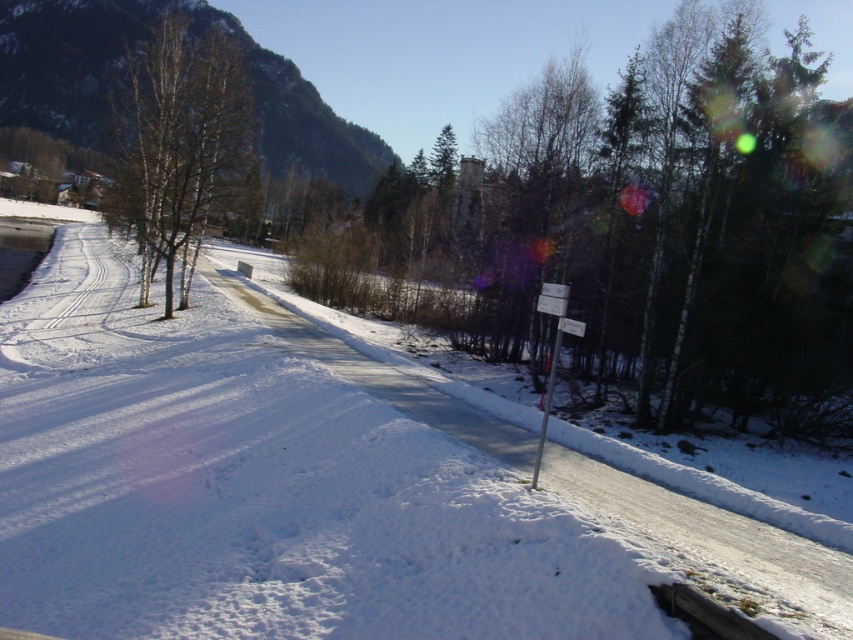
Consider the image. Can you confirm if bare birch trees at left is positioned below metallic pole at center-right?

No.

Is bare birch trees at left positioned behind metallic pole at center-right?

Yes.

Locate an element on the screen. bare birch trees at left is located at coordinates (178, 147).

The width and height of the screenshot is (853, 640). I want to click on bare birch trees at left, so click(x=178, y=147).

Locate an element on the screen. This screenshot has height=640, width=853. bare birch trees at left is located at coordinates (178, 147).

At what (x,y) coordinates should I click in order to perform the action: click on bare birch trees at left. Please return your answer as a coordinate pair (x, y). Looking at the image, I should click on (178, 147).

Does white snow at center have a lesser width compared to metallic pole at center-right?

In fact, white snow at center might be wider than metallic pole at center-right.

Does white snow at center lie behind metallic pole at center-right?

No, it is not.

Is point (596, 504) positioned behind point (560, 328)?

No, it is in front of (560, 328).

The width and height of the screenshot is (853, 640). I want to click on white snow at center, so tap(712, 538).